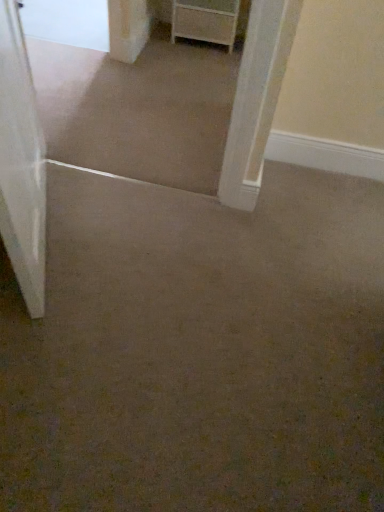
In order to face white matte door at left, should I rotate leftwards or rightwards?

To align with it, rotate left about 22.348°.

The height and width of the screenshot is (512, 384). Find the location of `white matte door at left`. white matte door at left is located at coordinates (21, 164).

The width and height of the screenshot is (384, 512). What do you see at coordinates (21, 164) in the screenshot? I see `white matte door at left` at bounding box center [21, 164].

Where is `white matte chest of drawers at upper center`? This screenshot has height=512, width=384. white matte chest of drawers at upper center is located at coordinates (205, 21).

The width and height of the screenshot is (384, 512). Describe the element at coordinates (205, 21) in the screenshot. I see `white matte chest of drawers at upper center` at that location.

Locate an element on the screen. The image size is (384, 512). white matte door at left is located at coordinates (21, 164).

Does white matte chest of drawers at upper center appear on the left side of white matte door at left?

No.

Is white matte chest of drawers at upper center in front of or behind white matte door at left in the image?

In the image, white matte chest of drawers at upper center appears behind white matte door at left.

Based on the photo, which is closer, (202, 38) or (31, 117)?

The point (31, 117) is in front.

Looking at this image, from the image's perspective, does white matte chest of drawers at upper center appear lower than white matte door at left?

Incorrect, from the image's perspective, white matte chest of drawers at upper center is higher than white matte door at left.

From a real-world perspective, which is physically above, white matte chest of drawers at upper center or white matte door at left?

In real-world perspective, white matte door at left is above.

Looking at their sizes, would you say white matte chest of drawers at upper center is wider or thinner than white matte door at left?

In the image, white matte chest of drawers at upper center appears to be wider than white matte door at left.

Is white matte chest of drawers at upper center taller or shorter than white matte door at left?

Considering their sizes, white matte chest of drawers at upper center has less height than white matte door at left.

Does white matte chest of drawers at upper center have a larger size compared to white matte door at left?

Actually, white matte chest of drawers at upper center might be smaller than white matte door at left.

Is white matte chest of drawers at upper center not within white matte door at left?

Indeed, white matte chest of drawers at upper center is completely outside white matte door at left.

Is white matte chest of drawers at upper center next to white matte door at left and touching it?

There is a gap between white matte chest of drawers at upper center and white matte door at left.

Is white matte chest of drawers at upper center aimed at white matte door at left?

Yes, white matte chest of drawers at upper center faces towards white matte door at left.

Can you tell me how much white matte chest of drawers at upper center and white matte door at left differ in facing direction?

114 degrees.

In the scene shown: How distant is white matte chest of drawers at upper center from white matte door at left?

white matte chest of drawers at upper center is 4.88 feet away from white matte door at left.

Locate an element on the screen. This screenshot has height=512, width=384. door lying below the white matte chest of drawers at upper center (from the image's perspective) is located at coordinates (21, 164).

Considering the positions of objects white matte door at left and white matte chest of drawers at upper center in the image provided, who is more to the right, white matte door at left or white matte chest of drawers at upper center?

white matte chest of drawers at upper center.

Which object is further away from the camera taking this photo, white matte door at left or white matte chest of drawers at upper center?

Positioned behind is white matte chest of drawers at upper center.

Which is behind, point (24, 79) or point (219, 11)?

Positioned behind is point (219, 11).

From the image's perspective, does white matte door at left appear lower than white matte chest of drawers at upper center?

Indeed, from the image's perspective, white matte door at left is shown beneath white matte chest of drawers at upper center.

From a real-world perspective, is white matte door at left located higher than white matte chest of drawers at upper center?

Yes, from a real-world perspective, white matte door at left is on top of white matte chest of drawers at upper center.

Consider the image. Which of these two, white matte door at left or white matte chest of drawers at upper center, is thinner?

With smaller width is white matte door at left.

From their relative heights in the image, would you say white matte door at left is taller or shorter than white matte chest of drawers at upper center?

In the image, white matte door at left appears to be taller than white matte chest of drawers at upper center.

Between white matte door at left and white matte chest of drawers at upper center, which one has smaller size?

white matte chest of drawers at upper center is smaller.

Does white matte door at left contain white matte chest of drawers at upper center?

Definitely not — white matte chest of drawers at upper center is not inside white matte door at left.

Is white matte door at left beside white matte chest of drawers at upper center?

No, white matte door at left is not touching white matte chest of drawers at upper center.

Is white matte door at left looking in the opposite direction of white matte chest of drawers at upper center?

No, white matte door at left is not facing away from white matte chest of drawers at upper center.

How much distance is there between white matte door at left and white matte chest of drawers at upper center?

1.49 meters.

Find the location of `the chest of drawers lying above the white matte door at left (from the image's perspective)`. the chest of drawers lying above the white matte door at left (from the image's perspective) is located at coordinates coord(205,21).

In the image, there is a white matte door at left. What are the coordinates of `the chest of drawers below it (from a real-world perspective)` in the screenshot? It's located at (205, 21).

I want to click on chest of drawers behind the white matte door at left, so click(205, 21).